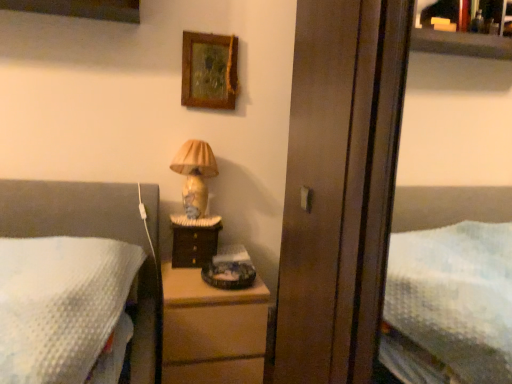
Question: Is matte ceramic lamp at upper center smaller than wooden picture frame at upper center?

Choices:
 (A) yes
 (B) no

Answer: (B)

Question: From the image's perspective, would you say matte ceramic lamp at upper center is shown under wooden picture frame at upper center?

Choices:
 (A) yes
 (B) no

Answer: (A)

Question: Is matte ceramic lamp at upper center turned away from wooden picture frame at upper center?

Choices:
 (A) no
 (B) yes

Answer: (A)

Question: Is matte ceramic lamp at upper center beside wooden picture frame at upper center?

Choices:
 (A) no
 (B) yes

Answer: (A)

Question: Considering the relative positions of matte ceramic lamp at upper center and wooden picture frame at upper center in the image provided, is matte ceramic lamp at upper center to the left of wooden picture frame at upper center from the viewer's perspective?

Choices:
 (A) yes
 (B) no

Answer: (A)

Question: Does matte ceramic lamp at upper center turn towards wooden picture frame at upper center?

Choices:
 (A) yes
 (B) no

Answer: (B)

Question: Considering the relative sizes of dark wood nightstand at center and matte ceramic lamp at upper center in the image provided, is dark wood nightstand at center taller than matte ceramic lamp at upper center?

Choices:
 (A) yes
 (B) no

Answer: (B)

Question: From the image's perspective, does dark wood nightstand at center appear higher than matte ceramic lamp at upper center?

Choices:
 (A) no
 (B) yes

Answer: (A)

Question: Would you say dark wood nightstand at center is a long distance from matte ceramic lamp at upper center?

Choices:
 (A) no
 (B) yes

Answer: (A)

Question: Does dark wood nightstand at center have a greater width compared to matte ceramic lamp at upper center?

Choices:
 (A) yes
 (B) no

Answer: (A)

Question: Is dark wood nightstand at center looking in the opposite direction of matte ceramic lamp at upper center?

Choices:
 (A) yes
 (B) no

Answer: (B)

Question: Is dark wood nightstand at center thinner than matte ceramic lamp at upper center?

Choices:
 (A) no
 (B) yes

Answer: (A)

Question: Is wooden picture frame at upper center bigger than matte ceramic lamp at upper center?

Choices:
 (A) no
 (B) yes

Answer: (A)